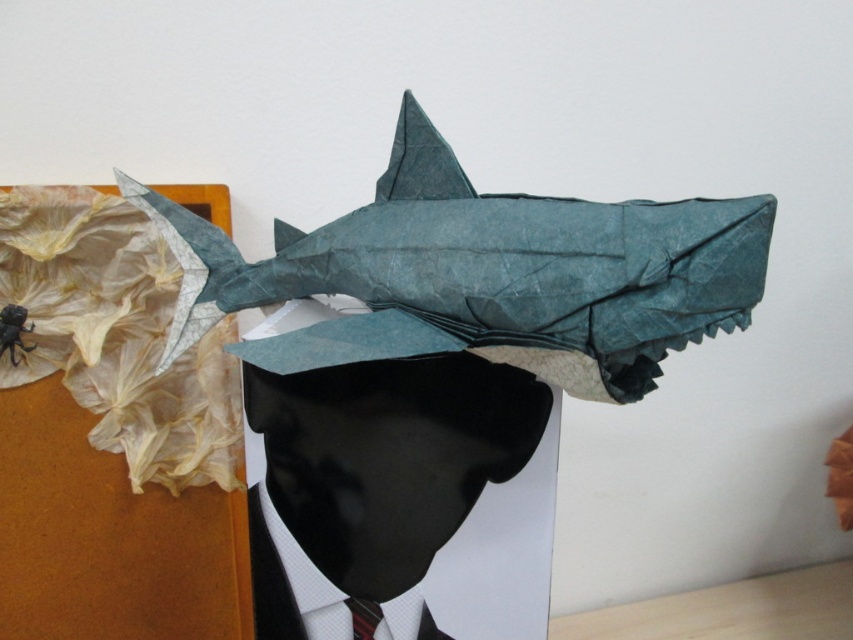
Question: Can you confirm if black fuzzy spider at upper left is positioned to the left of red striped tie at center?

Choices:
 (A) no
 (B) yes

Answer: (B)

Question: Which point is farther to the camera?

Choices:
 (A) matte paper man at center
 (B) red striped tie at center
 (C) black fuzzy spider at upper left

Answer: (C)

Question: Which point appears closest to the camera in this image?

Choices:
 (A) (357, 612)
 (B) (322, 560)
 (C) (9, 308)

Answer: (B)

Question: Does matte paper man at center appear on the right side of red striped tie at center?

Choices:
 (A) yes
 (B) no

Answer: (A)

Question: Estimate the real-world distances between objects in this image. Which object is farther from the black fuzzy spider at upper left?

Choices:
 (A) matte paper man at center
 (B) red striped tie at center

Answer: (B)

Question: Does matte paper man at center have a smaller size compared to red striped tie at center?

Choices:
 (A) no
 (B) yes

Answer: (A)